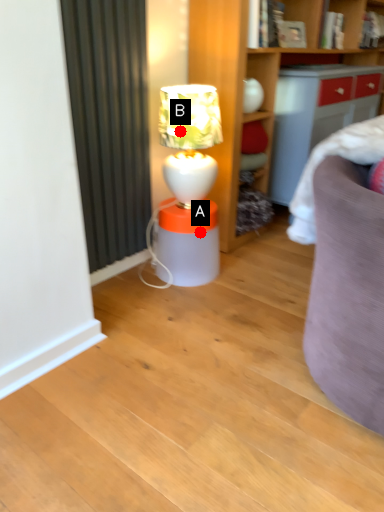
Question: Two points are circled on the image, labeled by A and B beside each circle. Which point is farther to the camera?

Choices:
 (A) A is further
 (B) B is further

Answer: (A)